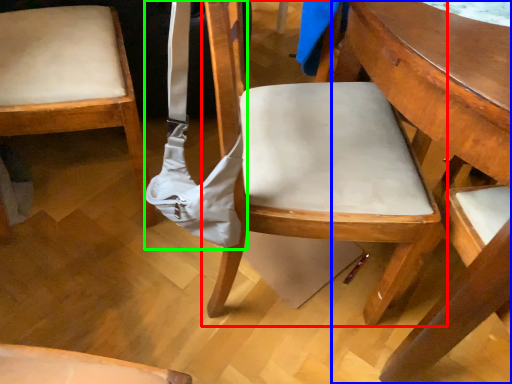
Question: Considering the real-world distances, which object is closest to chair (highlighted by a red box)? table (highlighted by a blue box) or shoulder bag (highlighted by a green box).

Choices:
 (A) table
 (B) shoulder bag

Answer: (B)